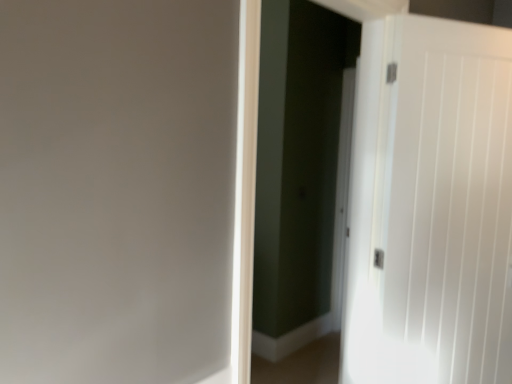
Find the location of a particular element. The height and width of the screenshot is (384, 512). free spot above white smooth door at right (from a real-world perspective) is located at coordinates (465, 26).